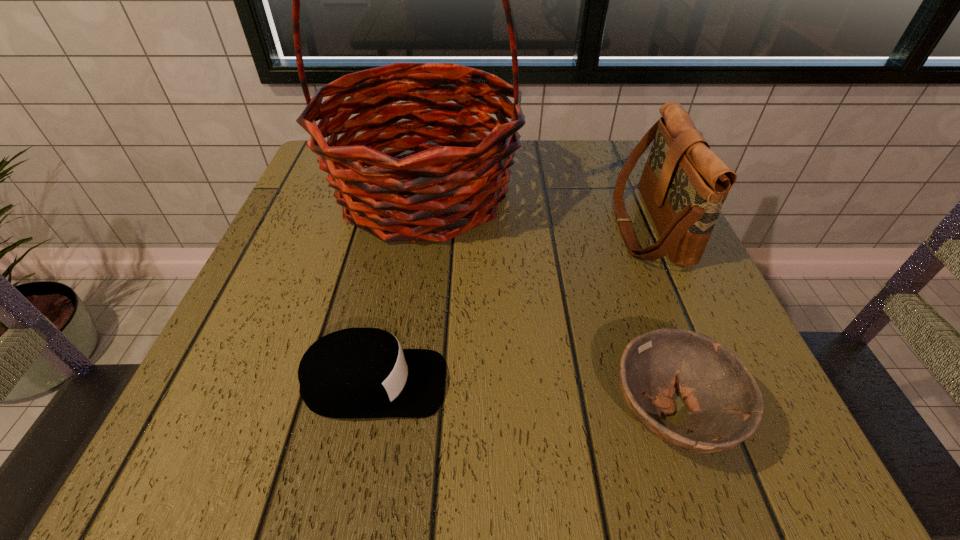
Find the location of a particular element. The width and height of the screenshot is (960, 540). vacant point that satisfies the following two spatial constraints: 1. on the front-facing side of the cap; 2. on the back side of the bowl is located at coordinates (369, 414).

Where is `vacant point that satisfies the following two spatial constraints: 1. on the front-facing side of the cap; 2. on the back side of the bowl`? Image resolution: width=960 pixels, height=540 pixels. vacant point that satisfies the following two spatial constraints: 1. on the front-facing side of the cap; 2. on the back side of the bowl is located at coordinates (369, 414).

I want to click on vacant region that satisfies the following two spatial constraints: 1. on the handle side of the bowl; 2. on the left side of the basket, so click(x=389, y=414).

Locate an element on the screen. Image resolution: width=960 pixels, height=540 pixels. free space that satisfies the following two spatial constraints: 1. on the front-facing side of the bowl; 2. on the right side of the cap is located at coordinates click(x=369, y=414).

Locate an element on the screen. This screenshot has height=540, width=960. free space that satisfies the following two spatial constraints: 1. on the front-facing side of the cap; 2. on the back side of the bowl is located at coordinates (369, 414).

Locate an element on the screen. The height and width of the screenshot is (540, 960). vacant region that satisfies the following two spatial constraints: 1. on the back side of the bowl; 2. on the front-facing side of the cap is located at coordinates (660, 383).

You are a GUI agent. You are given a task and a screenshot of the screen. Output one action in this format:
    pyautogui.click(x=<x>, y=<y>)
    Task: Click on the vacant position in the image that satisfies the following two spatial constraints: 1. on the front-facing side of the cap; 2. on the back side of the bowl
    This screenshot has height=540, width=960.
    Given the screenshot: What is the action you would take?
    pyautogui.click(x=369, y=414)

Locate an element on the screen. free space that satisfies the following two spatial constraints: 1. on the handle side of the basket; 2. on the front-facing side of the cap is located at coordinates (394, 383).